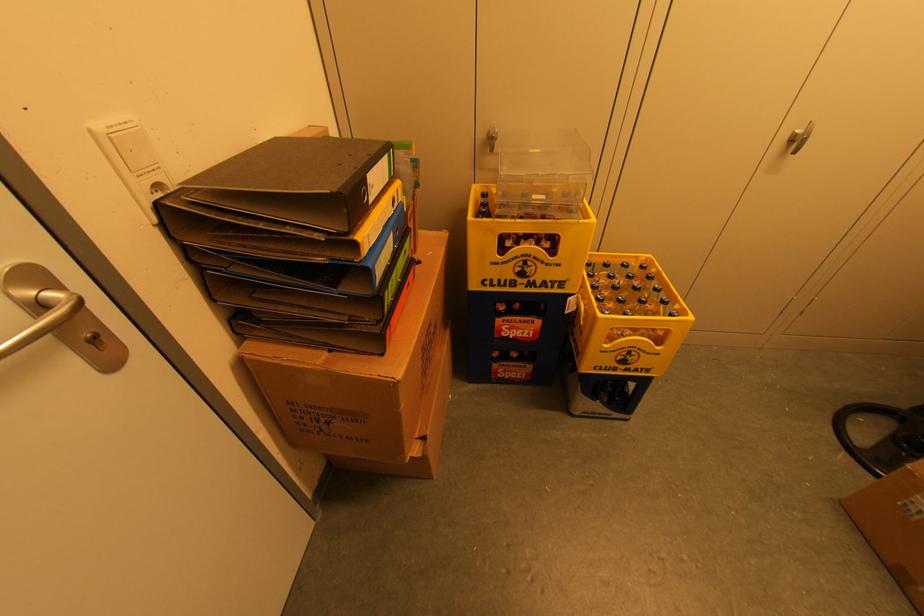
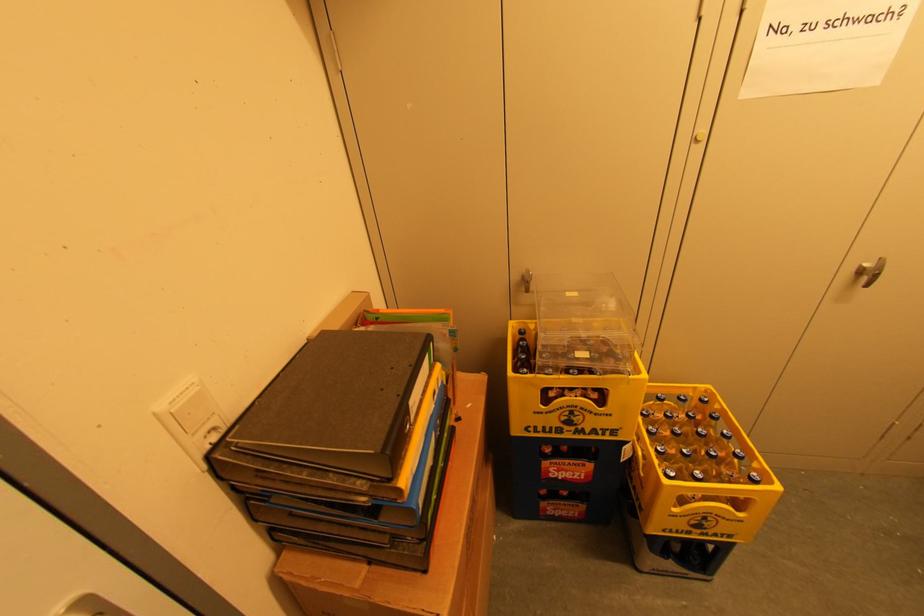
Where in the second image is the point corresponding to the point at 627,264 from the first image?

(686, 398)